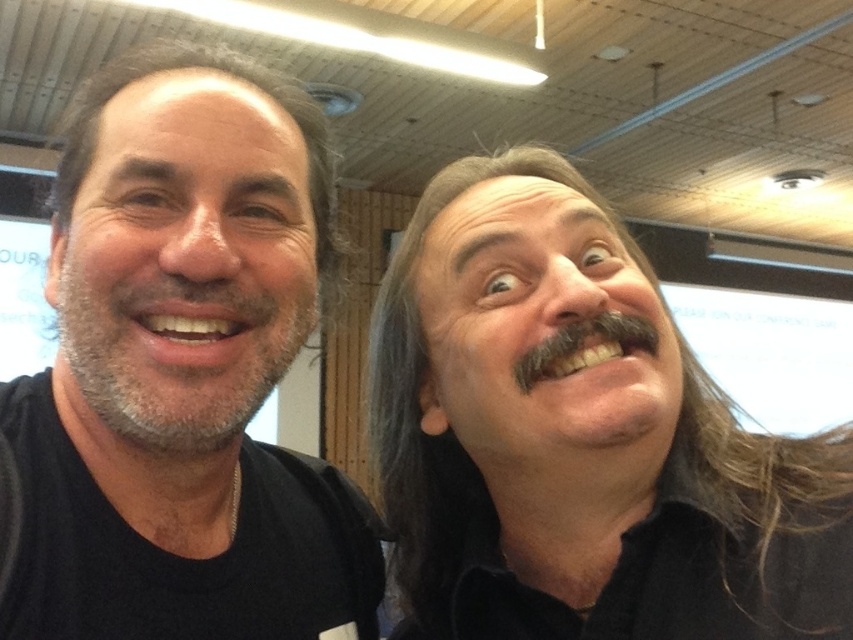
You are a photographer trying to capture a group photo of the smooth skin face at left and the smooth skin face at center. If you want to ensure both faces are framed equally in the photo, which face should you adjust to be closer to the camera?

The smooth skin face at left has a greater width than the smooth skin face at center. To frame both faces equally, you should move the smooth skin face at left closer to the camera so that its apparent size matches the smooth skin face at center.

You are a photographer setting up a camera to take a group photo of the two people in the scene. The camera is positioned so that it can capture both the matte black shirt at left and the smooth skin face at center. Based on their sizes in the image, which object should appear larger in the final photo?

The matte black shirt at left appears larger in the final photo because it is taller than the smooth skin face at center.

You are an AI analyzing the positions of objects in an image. The scene shows two people in a conference room. You need to determine the exact 2D coordinates of the matte black shirt at left. What are its coordinates?

The coordinates of the matte black shirt at left are at point (x=181, y=372).